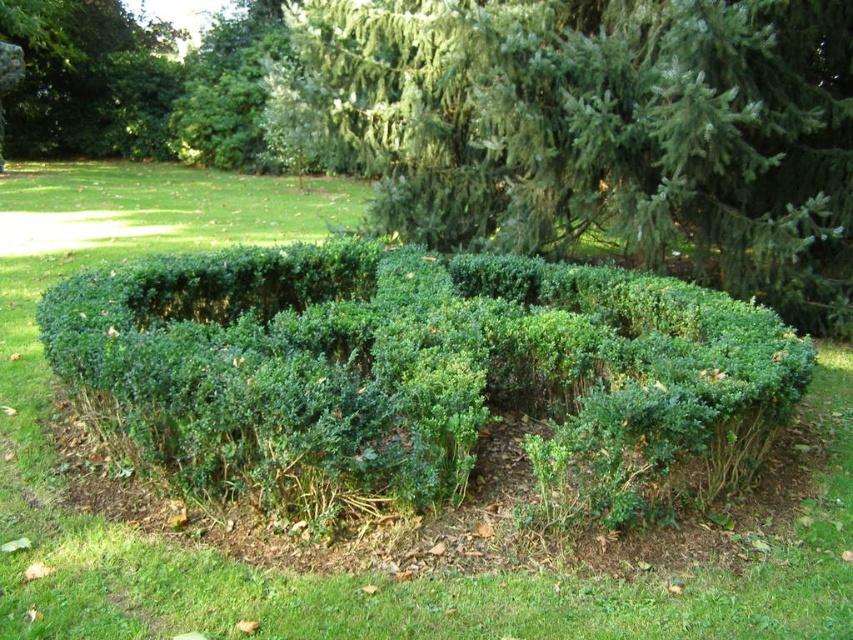
You are standing in the garden and want to place a 3.5 meter long bench. The point where you want to place it is at point (73,380). Can you fit the bench there?

The point (73,380) is 4.03 meters from the viewer. Since the bench is 3.5 meters long, it can fit at that location because the distance from the viewer is greater than the bench length.

You are standing in the garden and want to place a 100 feet long fence between the green leafy hedge at center and the green leafy bush at upper left. Will the fence be long enough to reach both ends?

The distance between the green leafy hedge at center and the green leafy bush at upper left is 74.12 feet. Since the fence is 100 feet long, it will be long enough to reach both ends with extra length remaining.

You are standing in the garden and want to place a small decorative rock between the two points, point (329, 134) and point (132, 120). Which point should you move towards to place the rock closer to the hedge?

To place the rock closer to the hedge, you should move towards point (329, 134) because it is closer to the viewer than point (132, 120), meaning it is physically nearer to the hedge in the garden.